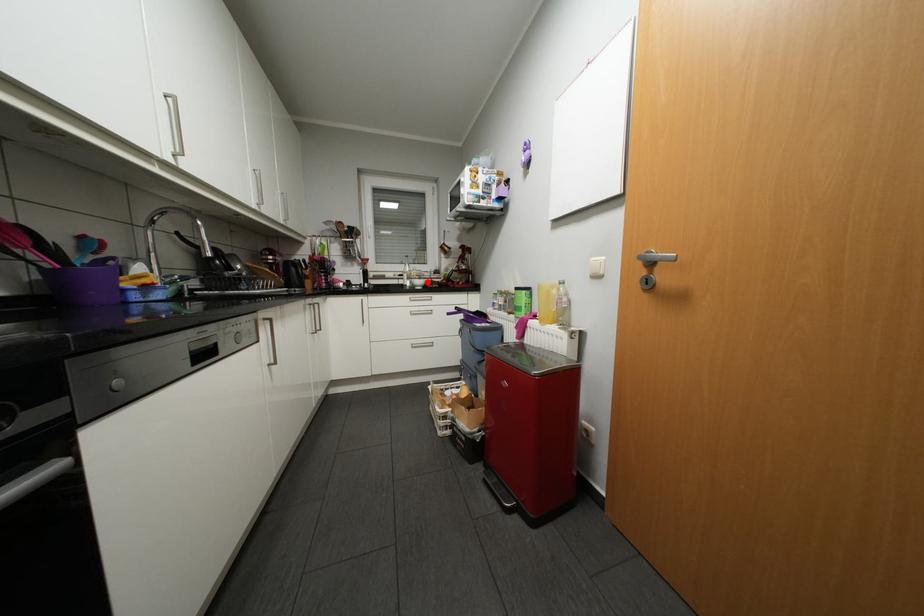
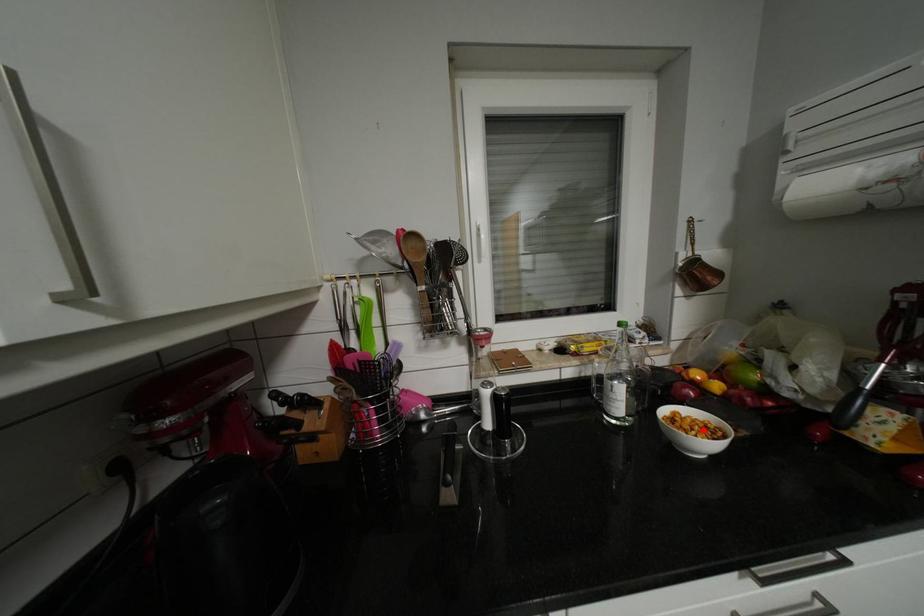
I am providing you with two images of the same scene from different viewpoints. A red point is marked on the first image and another point is marked on the second image. Is the red point in image1 aligned with the point shown in image2?

→ Yes